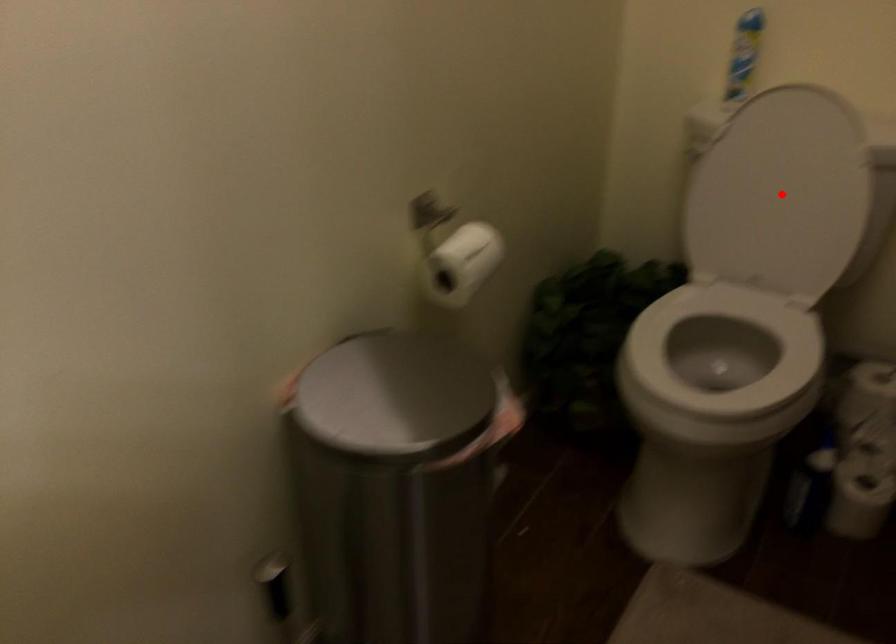
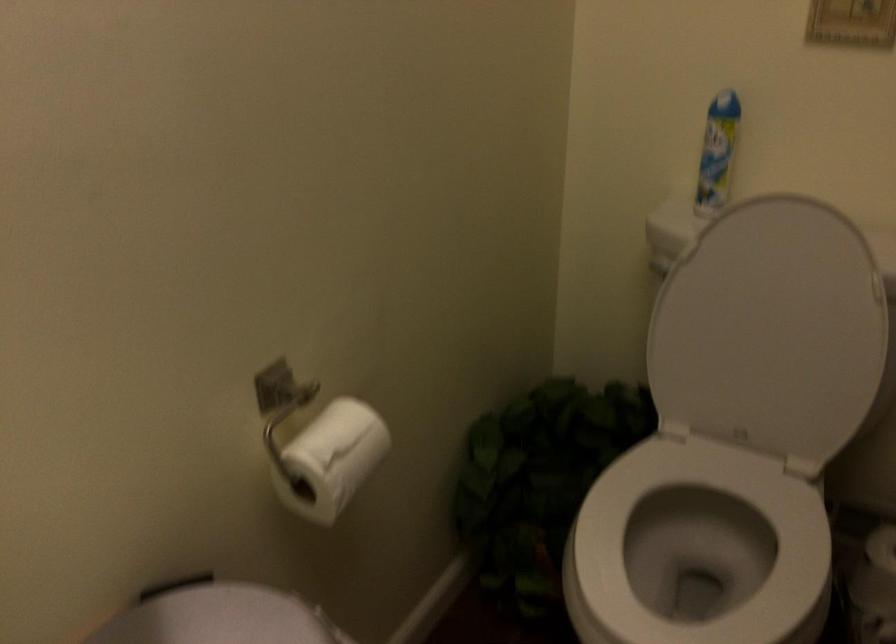
Question: I am providing you with two images of the same scene from different viewpoints. A red point is shown in image1. For the corresponding object point in image2, is it positioned nearer or farther from the camera?

Choices:
 (A) Nearer
 (B) Farther

Answer: (A)